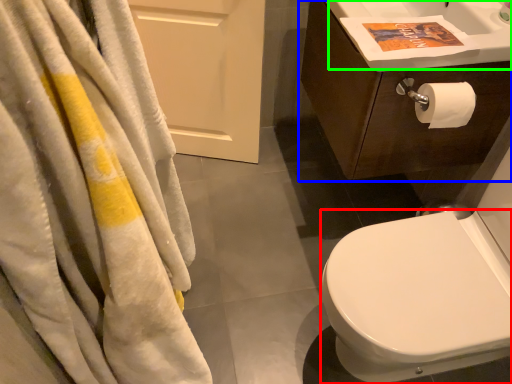
Question: Which object is the farthest from bidet (highlighted by a red box)? Choose among these: bathroom cabinet (highlighted by a blue box) or sink (highlighted by a green box).

Choices:
 (A) bathroom cabinet
 (B) sink

Answer: (B)